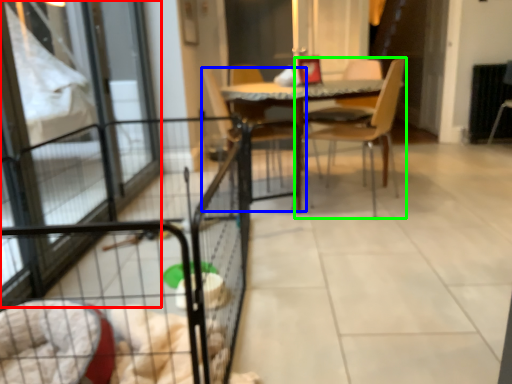
Question: Which is farther away from screen door (highlighted by a red box)? chair (highlighted by a blue box) or chair (highlighted by a green box)?

Choices:
 (A) chair
 (B) chair

Answer: (B)